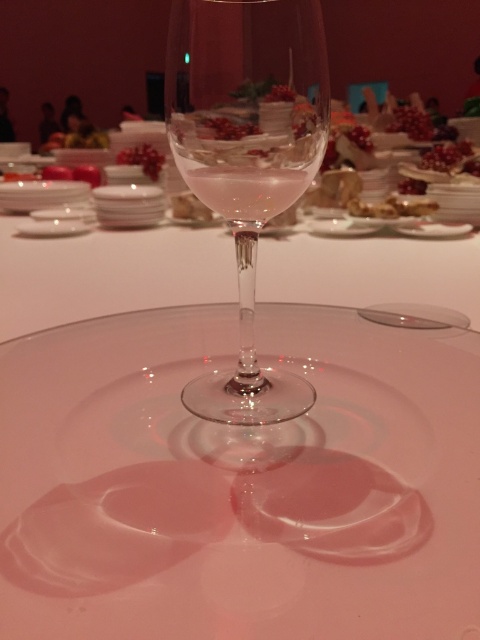
Question: Estimate the real-world distances between objects in this image. Which object is farther from the matte gold plate at upper center?

Choices:
 (A) transparent glass plate at center
 (B) pink glossy berries at upper center

Answer: (A)

Question: Is transparent glass plate at center wider than matte gold plate at upper center?

Choices:
 (A) yes
 (B) no

Answer: (A)

Question: Which object is closer to the camera taking this photo?

Choices:
 (A) pink glossy berries at upper center
 (B) matte gold plate at upper center
 (C) clear glass wine at center

Answer: (C)

Question: Is pink glossy berries at upper center wider than translucent glass at center?

Choices:
 (A) yes
 (B) no

Answer: (B)

Question: Does clear glass wine at center have a lesser width compared to translucent glass at center?

Choices:
 (A) no
 (B) yes

Answer: (B)

Question: Which object is farther from the camera taking this photo?

Choices:
 (A) translucent glass at center
 (B) matte gold plate at upper center

Answer: (B)